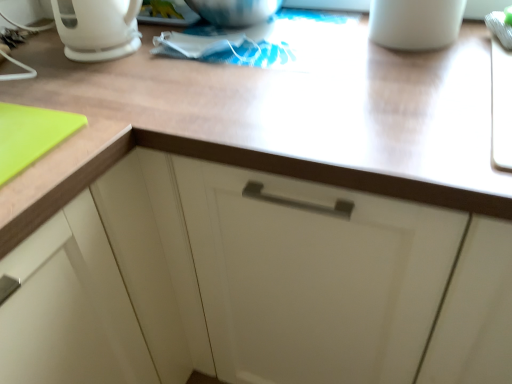
Question: From a real-world perspective, is wooden at upper center physically below white matte mug at upper right?

Choices:
 (A) no
 (B) yes

Answer: (B)

Question: From the image's perspective, is wooden at upper center below white matte mug at upper right?

Choices:
 (A) yes
 (B) no

Answer: (A)

Question: Considering the relative sizes of wooden at upper center and white matte mug at upper right in the image provided, is wooden at upper center taller than white matte mug at upper right?

Choices:
 (A) no
 (B) yes

Answer: (B)

Question: Is wooden at upper center not inside white matte mug at upper right?

Choices:
 (A) no
 (B) yes

Answer: (B)

Question: From the image's perspective, would you say wooden at upper center is positioned over white matte mug at upper right?

Choices:
 (A) no
 (B) yes

Answer: (A)

Question: From a real-world perspective, is wooden at upper center located higher than white matte mug at upper right?

Choices:
 (A) no
 (B) yes

Answer: (A)

Question: Does white matte mug at upper right have a lesser height compared to wooden at upper center?

Choices:
 (A) yes
 (B) no

Answer: (A)

Question: Considering the relative sizes of white matte mug at upper right and wooden at upper center in the image provided, is white matte mug at upper right smaller than wooden at upper center?

Choices:
 (A) yes
 (B) no

Answer: (A)

Question: Is there a large distance between white matte mug at upper right and wooden at upper center?

Choices:
 (A) yes
 (B) no

Answer: (B)

Question: Does white matte mug at upper right have a lesser width compared to wooden at upper center?

Choices:
 (A) no
 (B) yes

Answer: (B)

Question: Is white matte mug at upper right positioned before wooden at upper center?

Choices:
 (A) yes
 (B) no

Answer: (B)

Question: From the image's perspective, would you say white matte mug at upper right is shown under wooden at upper center?

Choices:
 (A) no
 (B) yes

Answer: (A)

Question: Does wooden at upper center appear on the right side of white glossy coffee pot at upper left?

Choices:
 (A) no
 (B) yes

Answer: (B)